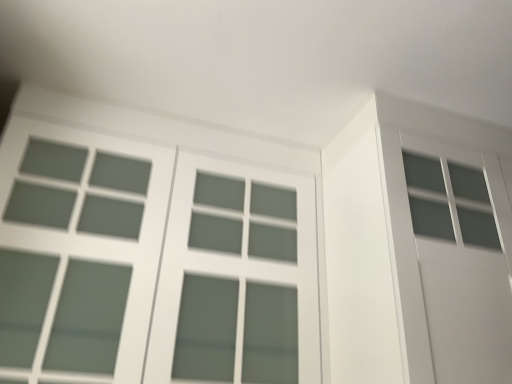
Question: From the image's perspective, is satin white window at upper left under satin white screen door at upper right?

Choices:
 (A) yes
 (B) no

Answer: (B)

Question: Is satin white window at upper left turned away from satin white screen door at upper right?

Choices:
 (A) yes
 (B) no

Answer: (B)

Question: Is satin white window at upper left smaller than satin white screen door at upper right?

Choices:
 (A) yes
 (B) no

Answer: (B)

Question: Does satin white window at upper left appear on the right side of satin white screen door at upper right?

Choices:
 (A) no
 (B) yes

Answer: (A)

Question: Does satin white window at upper left turn towards satin white screen door at upper right?

Choices:
 (A) no
 (B) yes

Answer: (A)

Question: Is satin white window at upper left placed right next to satin white screen door at upper right?

Choices:
 (A) no
 (B) yes

Answer: (A)

Question: Is satin white screen door at upper right shorter than satin white window at upper left?

Choices:
 (A) yes
 (B) no

Answer: (A)

Question: Considering the relative sizes of satin white screen door at upper right and satin white window at upper left in the image provided, is satin white screen door at upper right smaller than satin white window at upper left?

Choices:
 (A) no
 (B) yes

Answer: (B)

Question: Can you confirm if satin white screen door at upper right is thinner than satin white window at upper left?

Choices:
 (A) no
 (B) yes

Answer: (B)

Question: Is satin white screen door at upper right positioned before satin white window at upper left?

Choices:
 (A) no
 (B) yes

Answer: (A)

Question: Is satin white screen door at upper right far away from satin white window at upper left?

Choices:
 (A) yes
 (B) no

Answer: (B)

Question: From the image's perspective, is satin white screen door at upper right above satin white window at upper left?

Choices:
 (A) no
 (B) yes

Answer: (A)

Question: Looking at their shapes, would you say satin white screen door at upper right is wider or thinner than satin white window at upper left?

Choices:
 (A) wide
 (B) thin

Answer: (B)